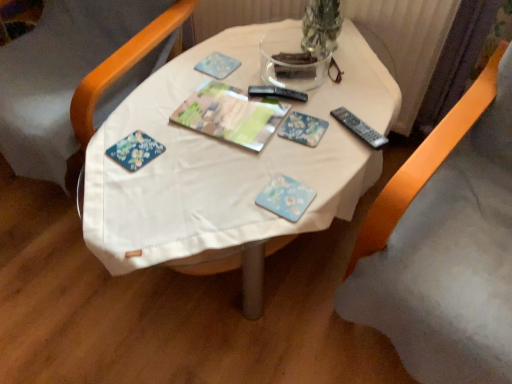
Where is `vacant area that lies between floral paper magazine at center and blue floral coaster at center, arranged as the first paperback book when ordered from the bottom`? This screenshot has width=512, height=384. vacant area that lies between floral paper magazine at center and blue floral coaster at center, arranged as the first paperback book when ordered from the bottom is located at coordinates (253, 164).